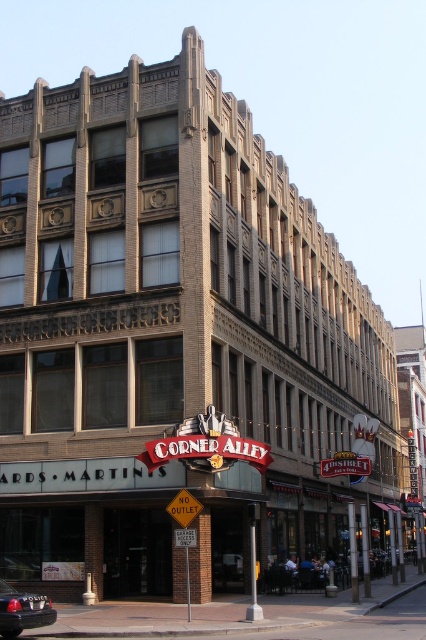
Question: Among these points, which one is farthest from the camera?

Choices:
 (A) (195, 504)
 (B) (25, 596)

Answer: (A)

Question: Which of the following is the farthest from the observer?

Choices:
 (A) yellow plastic sign at lower center
 (B) metallic silver sedan at lower left

Answer: (A)

Question: Can you confirm if metallic silver sedan at lower left is positioned to the left of yellow plastic sign at lower center?

Choices:
 (A) yes
 (B) no

Answer: (A)

Question: Does metallic silver sedan at lower left appear on the left side of yellow plastic sign at lower center?

Choices:
 (A) yes
 (B) no

Answer: (A)

Question: Does metallic silver sedan at lower left have a smaller size compared to yellow plastic sign at lower center?

Choices:
 (A) yes
 (B) no

Answer: (A)